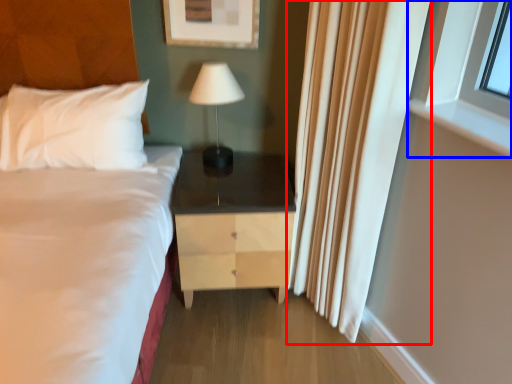
Question: Among these objects, which one is farthest to the camera, curtain (highlighted by a red box) or window (highlighted by a blue box)?

Choices:
 (A) curtain
 (B) window

Answer: (B)